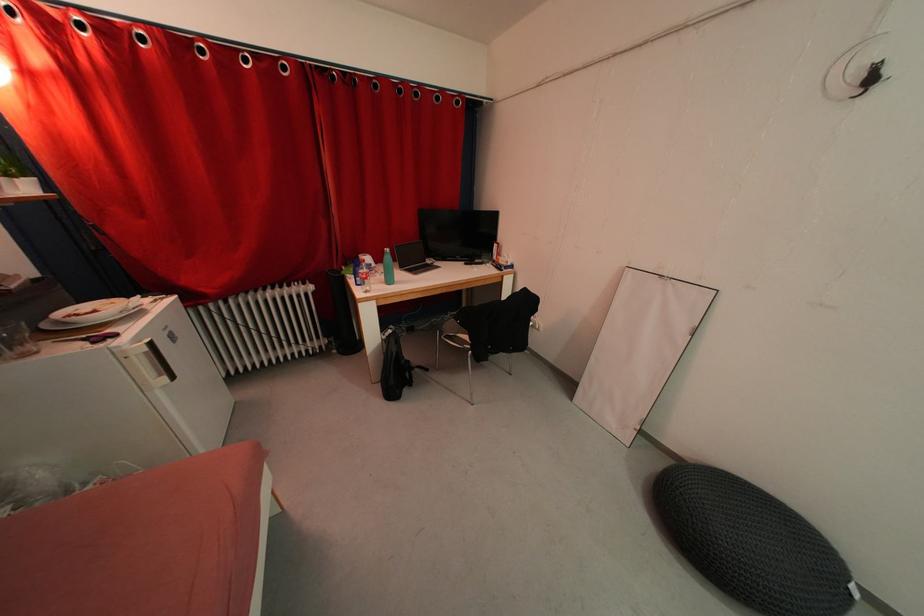
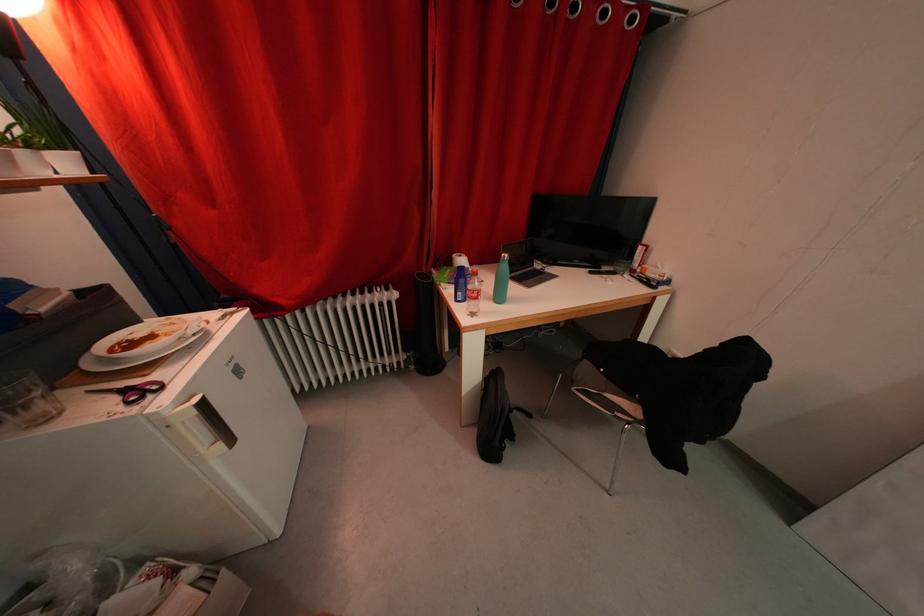
Where in the second image is the point corresponding to pixel 265 294 from the first image?

(346, 302)